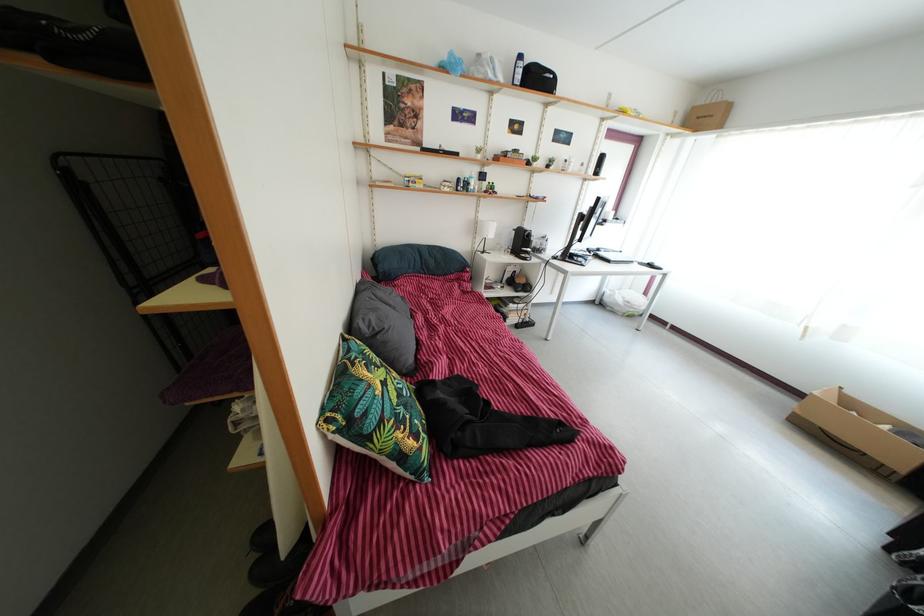
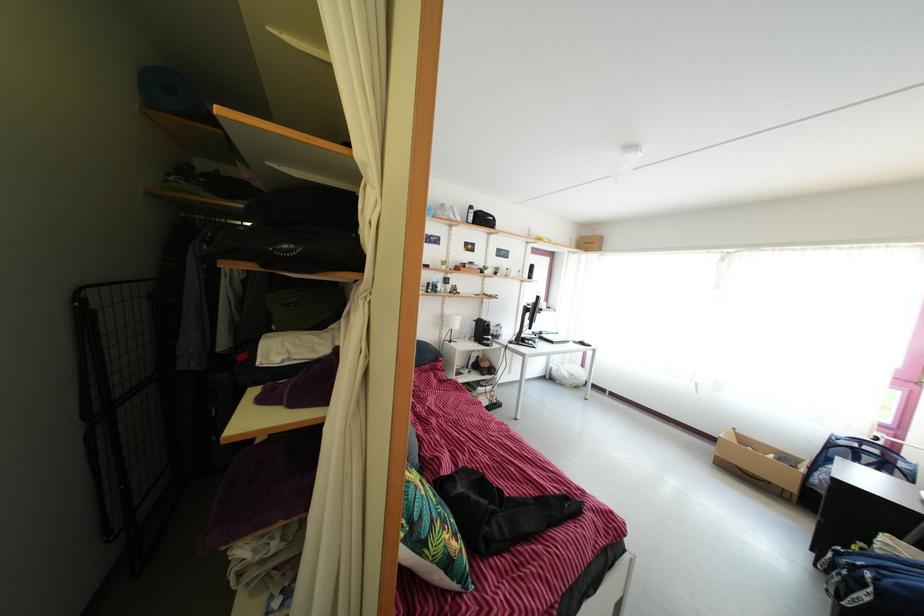
The point at (x=528, y=251) is marked in the first image. Where is the corresponding point in the second image?

(489, 339)